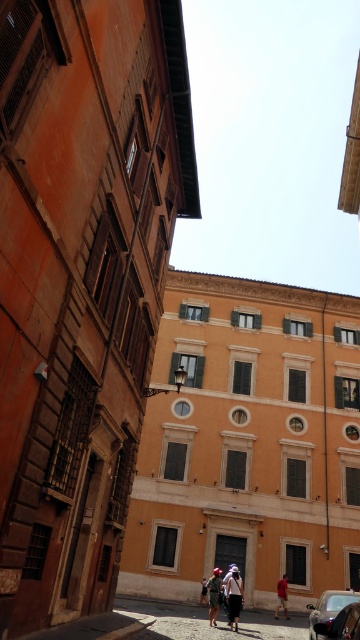
Can you confirm if denim jacket at center is wider than denim shorts at center?

In fact, denim jacket at center might be narrower than denim shorts at center.

Can you confirm if denim jacket at center is shorter than denim shorts at center?

Indeed, denim jacket at center has a lesser height compared to denim shorts at center.

You are a GUI agent. You are given a task and a screenshot of the screen. Output one action in this format:
    pyautogui.click(x=<x>, y=<y>)
    Task: Click on the denim jacket at center
    This screenshot has width=360, height=640.
    Given the screenshot: What is the action you would take?
    pyautogui.click(x=235, y=596)

Is shiny black car at center positioned behind denim shorts at center?

No, shiny black car at center is in front of denim shorts at center.

Does shiny black car at center appear on the left side of denim shorts at center?

In fact, shiny black car at center is to the right of denim shorts at center.

The width and height of the screenshot is (360, 640). Describe the element at coordinates (329, 608) in the screenshot. I see `shiny black car at center` at that location.

At what (x,y) coordinates should I click in order to perform the action: click on shiny black car at center. Please return your answer as a coordinate pair (x, y). The height and width of the screenshot is (640, 360). Looking at the image, I should click on (329, 608).

Does shiny black car at center have a lesser height compared to denim jacket at center?

No.

What do you see at coordinates (329, 608) in the screenshot? I see `shiny black car at center` at bounding box center [329, 608].

Is point (324, 614) farther from viewer compared to point (231, 580)?

No, (324, 614) is in front of (231, 580).

Locate an element on the screen. The image size is (360, 640). shiny black car at center is located at coordinates (329, 608).